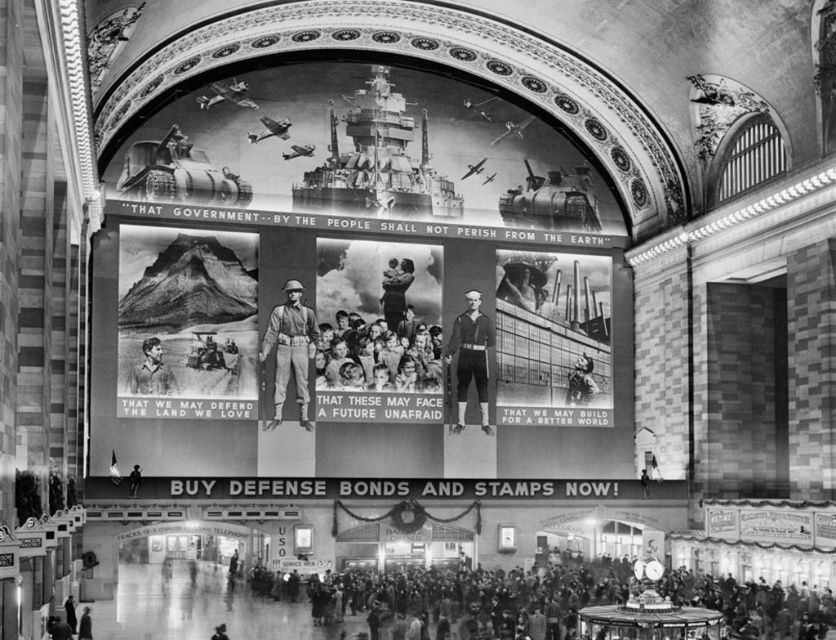
Question: Which of the following is the farthest from the observer?

Choices:
 (A) (513, 616)
 (B) (299, 356)
 (C) (436, 348)

Answer: (C)

Question: Is dark gray clothing at lower center smaller than smooth skin baby at center?

Choices:
 (A) no
 (B) yes

Answer: (A)

Question: Among these objects, which one is farthest from the camera?

Choices:
 (A) smooth skin group at center
 (B) matte paper poster at center
 (C) smooth skin person at lower center

Answer: (A)

Question: Which point appears farthest from the camera in this image?

Choices:
 (A) (396, 296)
 (B) (654, 620)
 (C) (182, 236)
 (D) (161, 387)

Answer: (A)

Question: Is smooth skin face at center to the left of smooth skin baby at center from the viewer's perspective?

Choices:
 (A) yes
 (B) no

Answer: (A)

Question: Is matte paper poster at center above smooth skin group at center?

Choices:
 (A) yes
 (B) no

Answer: (A)